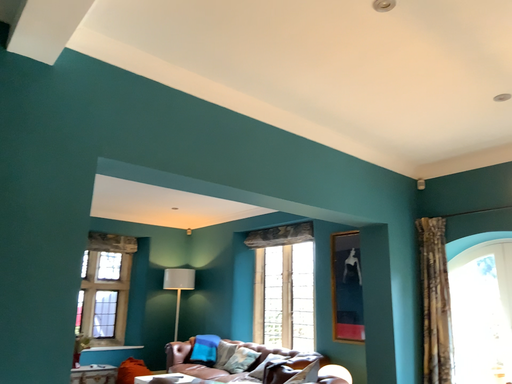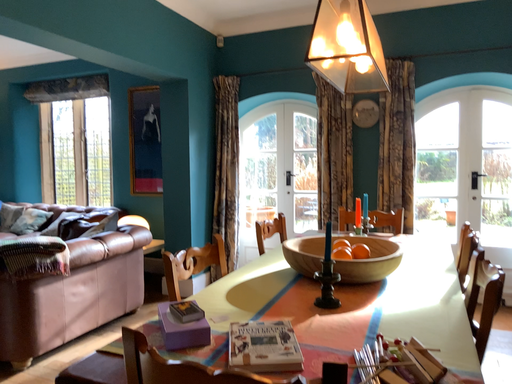
Question: Which way did the camera rotate in the video?

Choices:
 (A) rotated right
 (B) rotated left

Answer: (A)